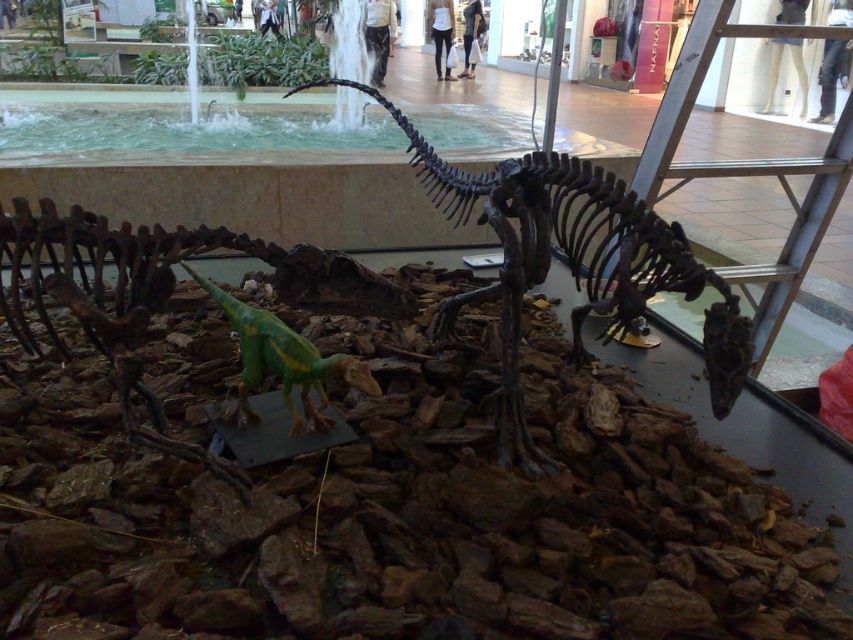
You are a child visiting the dinosaur exhibit and want to touch both the brown metallic skeleton at center and the green matte plastic dinosaur at center. Which one do you think you can reach more easily?

The green matte plastic dinosaur at center is smaller than the brown metallic skeleton at center, so it might be easier to reach.

You are a maintenance worker needing to reach the top of the metallic silver ladder at right to fix a light. The brown metallic skeleton at center is blocking your path. Can you walk around it without getting too close?

The brown metallic skeleton at center is 73.11 centimeters away from the metallic silver ladder at right, so you can walk around it safely as the distance allows enough space to maneuver without getting too close.